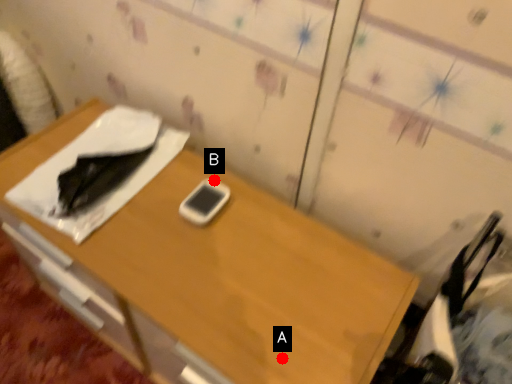
Question: Two points are circled on the image, labeled by A and B beside each circle. Which of the following is the farthest from the observer?

Choices:
 (A) A is further
 (B) B is further

Answer: (B)